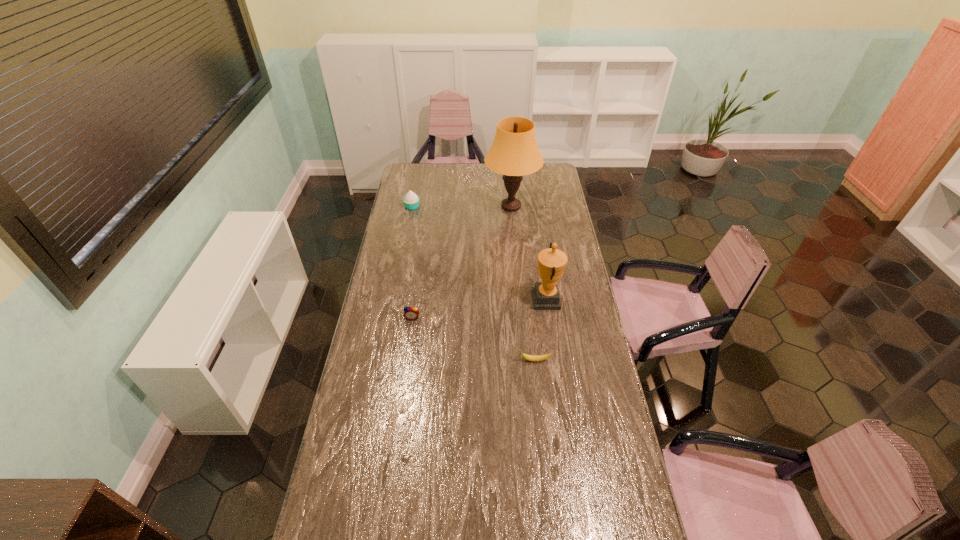
At what (x,y) coordinates should I click in order to perform the action: click on vacant space located at the front of the fourth shortest object with handles. Please return your answer as a coordinate pair (x, y). This screenshot has width=960, height=540. Looking at the image, I should click on (470, 299).

I want to click on vacant point located 0.230m at the front of the fourth shortest object with handles, so click(x=480, y=299).

At what (x,y) coordinates should I click in order to perform the action: click on vacant space located at the front of the fourth shortest object with handles. Please return your answer as a coordinate pair (x, y). The image size is (960, 540). Looking at the image, I should click on (477, 299).

You are a GUI agent. You are given a task and a screenshot of the screen. Output one action in this format:
    pyautogui.click(x=<x>, y=<y>)
    Task: Click on the free space located on the front of the third shortest object
    The image size is (960, 540).
    Given the screenshot: What is the action you would take?
    pyautogui.click(x=402, y=258)

I want to click on vacant point located 0.200m on the front-facing side of the second nearest object, so click(406, 361).

The height and width of the screenshot is (540, 960). Identify the location of vacant space situated 0.190m at the stem of the banana. (468, 360).

Locate an element on the screen. The width and height of the screenshot is (960, 540). free space located at the stem of the banana is located at coordinates (463, 360).

Where is `free space located at the stem of the banana`? This screenshot has width=960, height=540. free space located at the stem of the banana is located at coordinates [x=452, y=360].

At what (x,y) coordinates should I click in order to perform the action: click on cupcake located at the left edge. Please return your answer as a coordinate pair (x, y). Looking at the image, I should click on (411, 201).

Find the location of a particular element. The width and height of the screenshot is (960, 540). alarm clock at the left edge is located at coordinates (411, 313).